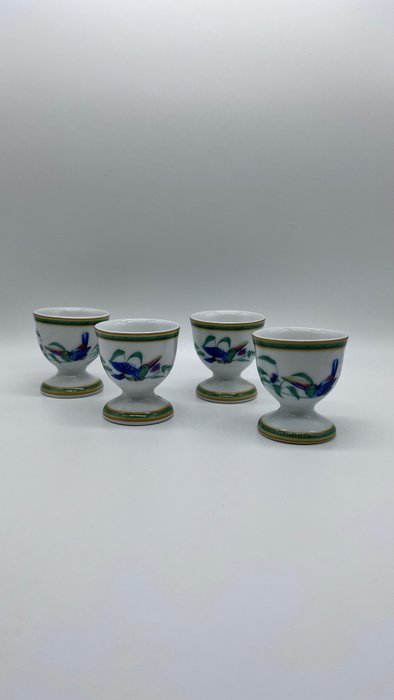
Identify the location of table. (184, 466), (58, 453), (344, 466).